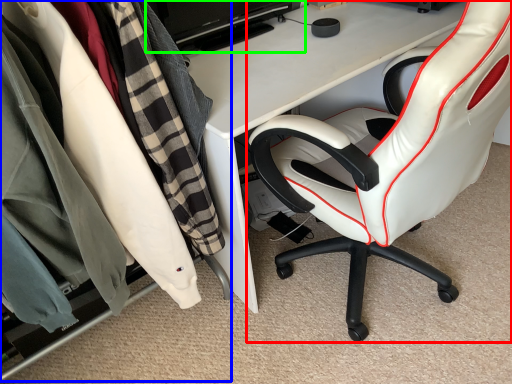
Question: Which is farther away from chair (highlighted by a red box)? closet (highlighted by a blue box) or computer monitor (highlighted by a green box)?

Choices:
 (A) closet
 (B) computer monitor

Answer: (B)